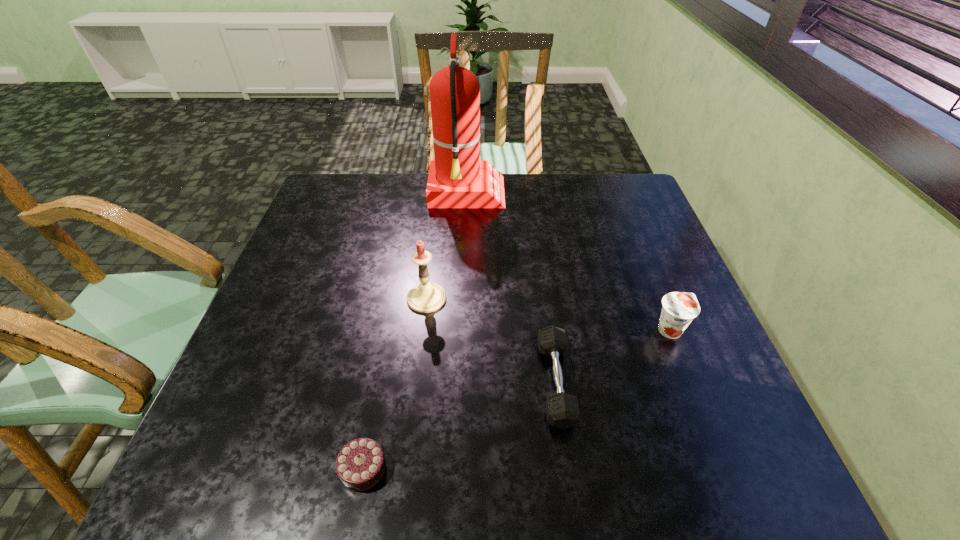
Where is `vacant space that's between the yogurt and the farthest object`? The height and width of the screenshot is (540, 960). vacant space that's between the yogurt and the farthest object is located at coordinates (568, 262).

Locate an element on the screen. This screenshot has width=960, height=540. vacant area that lies between the nearest object and the third tallest object is located at coordinates (516, 399).

Find the location of a particular element. vacant space in between the dumbbell and the fire extinguisher is located at coordinates (511, 288).

What are the coordinates of `unoccupied area between the second object from right to left and the farthest object` in the screenshot? It's located at (511, 288).

Identify the location of object that is the second closest to the dumbbell. (426, 297).

Where is `object identified as the fourth closest to the rightmost object`? The image size is (960, 540). object identified as the fourth closest to the rightmost object is located at coordinates (360, 465).

Locate an element on the screen. Image resolution: width=960 pixels, height=540 pixels. free spot that satisfies the following two spatial constraints: 1. on the back side of the dumbbell; 2. on the front-facing side of the farthest object is located at coordinates pos(529,194).

Identify the location of free space that satisfies the following two spatial constraints: 1. on the back side of the shortest object; 2. on the left side of the yogurt. (390, 330).

At what (x,y) coordinates should I click in order to perform the action: click on blank area in the image that satisfies the following two spatial constraints: 1. on the back side of the third shortest object; 2. on the front-facing side of the tallest object. Please return your answer as a coordinate pair (x, y). The image size is (960, 540). Looking at the image, I should click on (616, 194).